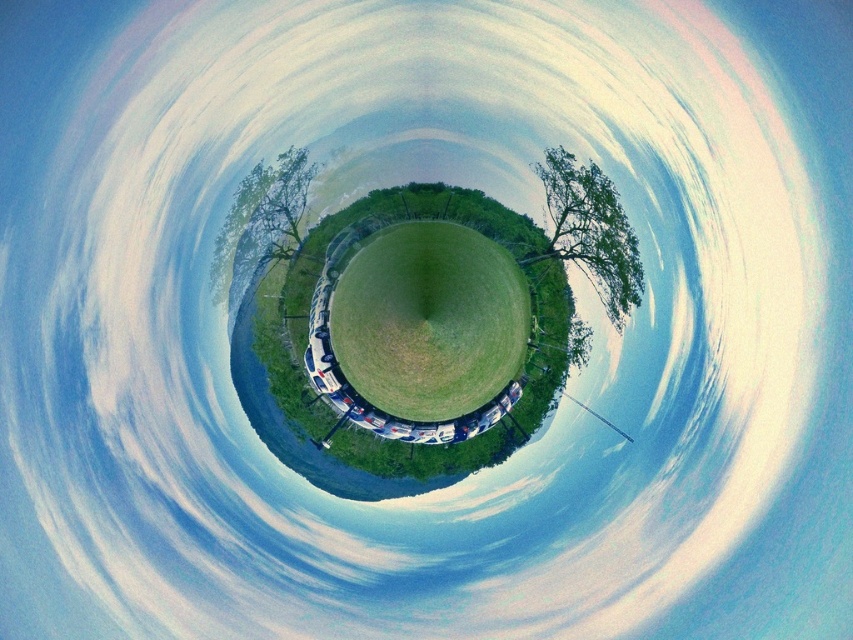
You are planning to place a picnic blanket between the green leafy tree at upper right and the green leafy tree at center. If your blanket is 30 centimeters wide, will it fit without overlapping either tree?

The distance between the green leafy tree at upper right and the green leafy tree at center is 36.60 centimeters. Since the blanket is 30 centimeters wide, it will fit between them without overlapping either tree.

You are standing in the middle of the green grassy field at center and want to take a photo of the green leafy tree at upper right. Which direction should you face to capture the tree in your camera view?

You should face upward because the green leafy tree at upper right is above the green grassy field at center, so looking upward will allow you to capture it in your camera view.

You are standing at the center of a spherical panorama image of a park. There is a point marked at coordinates point (428, 321). What is located at this point?

The point (428, 321) indicates green grassy field at center.